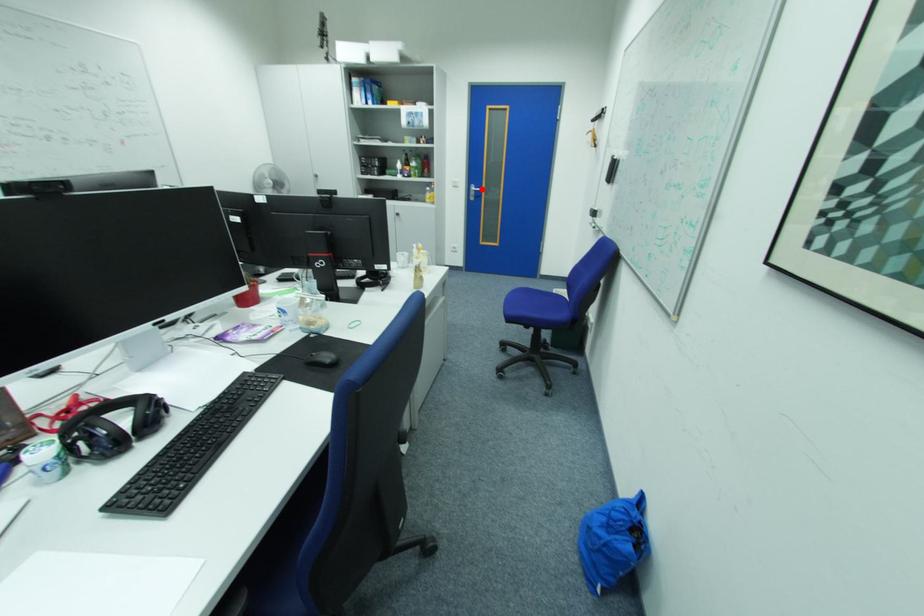
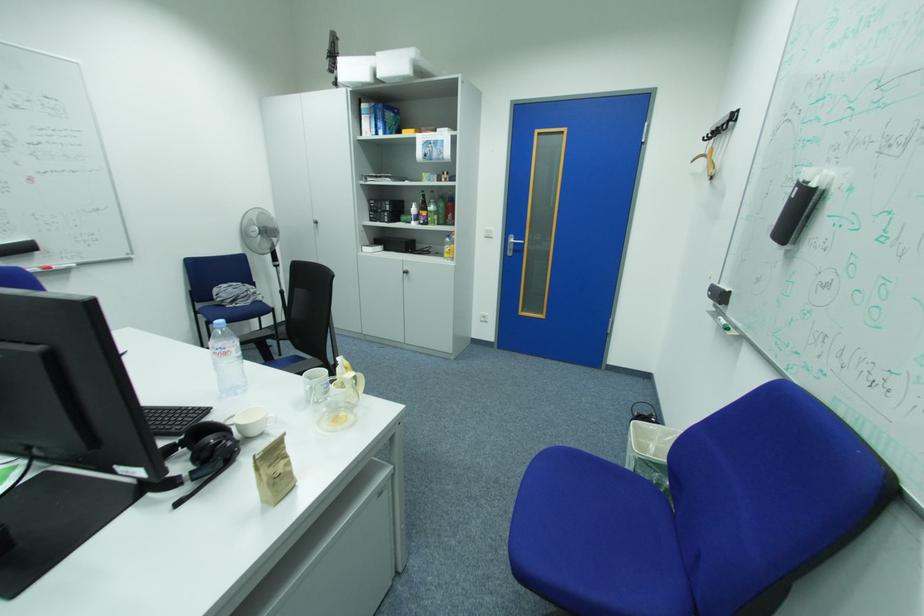
Question: I am providing you with two images of the same scene from different viewpoints. In image1, a red point is highlighted. Considering the same 3D point in image2, which of the following is correct?

Choices:
 (A) It is closer
 (B) It is farther

Answer: (B)